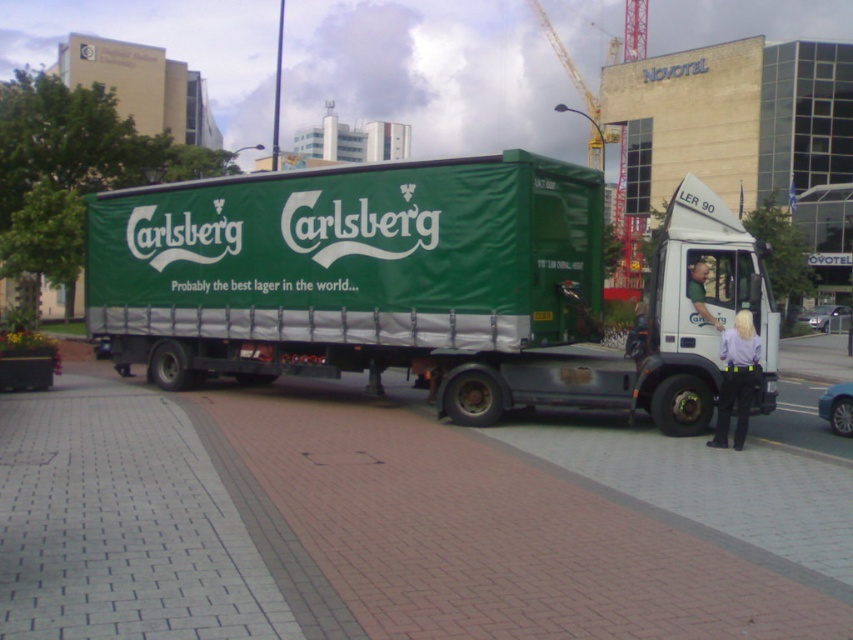
Question: Is brick pavement at center bigger than light brown leather jacket at center?

Choices:
 (A) no
 (B) yes

Answer: (B)

Question: Estimate the real-world distances between objects in this image. Which object is closer to the brick pavement at center?

Choices:
 (A) light brown leather jacket at center
 (B) green fabric truck at center

Answer: (B)

Question: Does brick pavement at center appear on the right side of green fabric truck at center?

Choices:
 (A) no
 (B) yes

Answer: (A)

Question: Which of the following is the farthest from the observer?

Choices:
 (A) (693, 296)
 (B) (225, 344)
 (C) (137, 636)

Answer: (B)

Question: Which point appears farthest from the camera in this image?

Choices:
 (A) (161, 312)
 (B) (688, 269)
 (C) (605, 598)

Answer: (A)

Question: Does brick pavement at center have a larger size compared to green fabric truck at center?

Choices:
 (A) yes
 (B) no

Answer: (B)